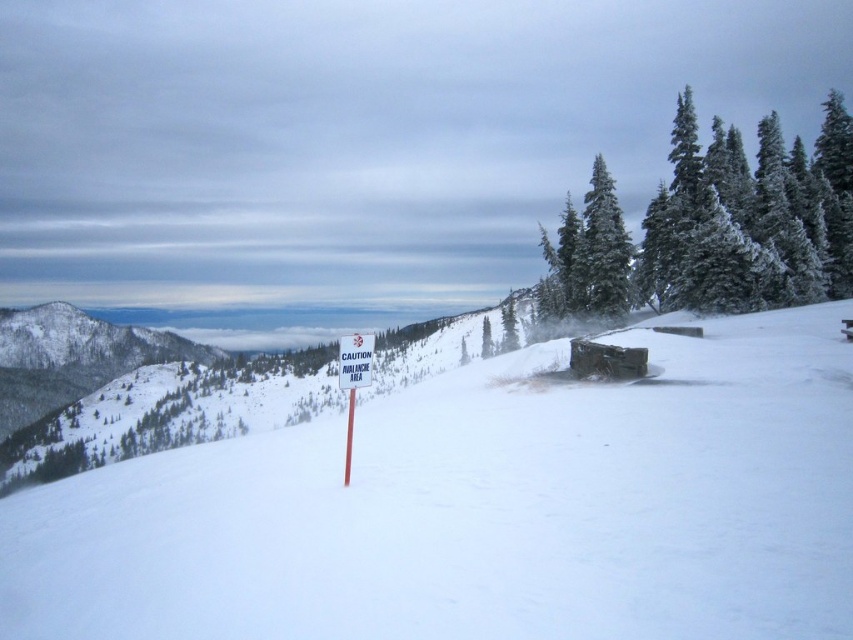
Is snow-covered evergreen at upper right wider than white plastic sign at center?

Indeed, snow-covered evergreen at upper right has a greater width compared to white plastic sign at center.

Is snow-covered evergreen at upper right positioned behind white plastic sign at center?

Yes, it is.

Is point (830, 138) positioned after point (373, 337)?

Yes, point (830, 138) is farther from viewer.

This screenshot has width=853, height=640. Find the location of `snow-covered evergreen at upper right`. snow-covered evergreen at upper right is located at coordinates (712, 227).

Is white snow at center to the right of snow-covered evergreen at upper right from the viewer's perspective?

In fact, white snow at center is to the left of snow-covered evergreen at upper right.

Which is more to the right, white snow at center or snow-covered evergreen at upper right?

From the viewer's perspective, snow-covered evergreen at upper right appears more on the right side.

At what (x,y) coordinates should I click in order to perform the action: click on white snow at center. Please return your answer as a coordinate pair (x, y). The width and height of the screenshot is (853, 640). Looking at the image, I should click on (480, 509).

Which of these two, white snow at center or white plastic sign at center, stands taller?

white snow at center is taller.

Which is in front, point (376, 604) or point (341, 337)?

Positioned in front is point (376, 604).

At what (x,y) coordinates should I click in order to perform the action: click on white snow at center. Please return your answer as a coordinate pair (x, y). Image resolution: width=853 pixels, height=640 pixels. Looking at the image, I should click on (480, 509).